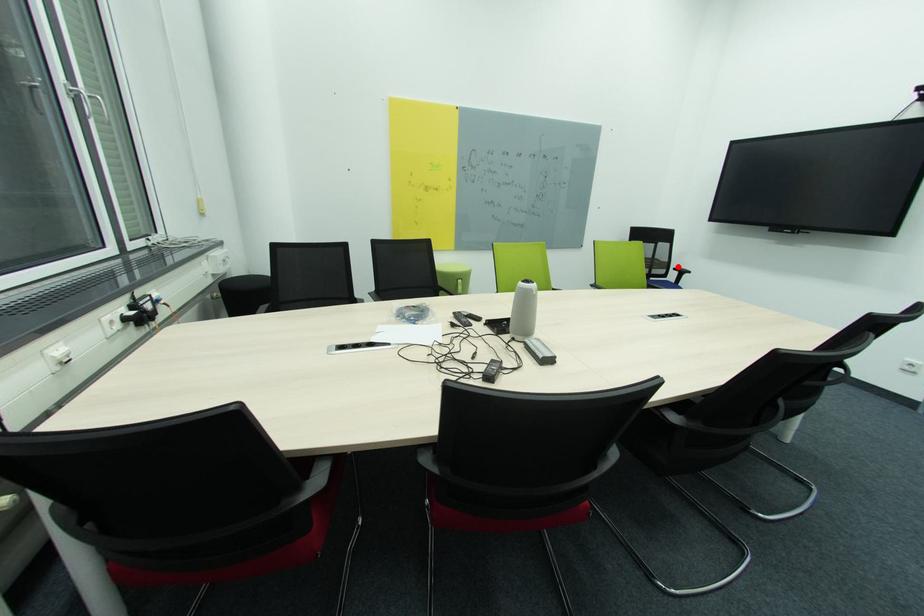
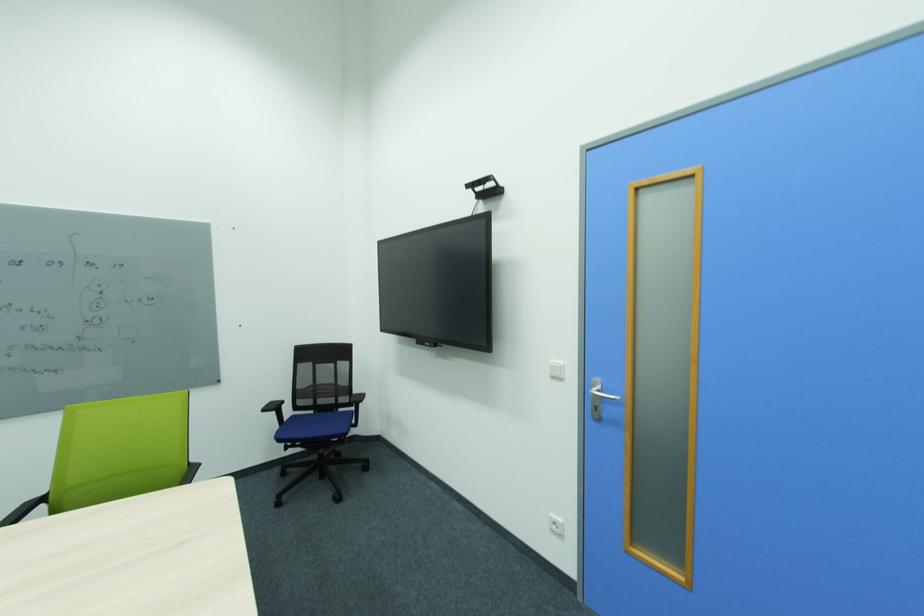
Question: I am providing you with two images of the same scene from different viewpoints. A red point is shown in image1. For the corresponding object point in image2, is it positioned nearer or farther from the camera?

Choices:
 (A) Nearer
 (B) Farther

Answer: (B)